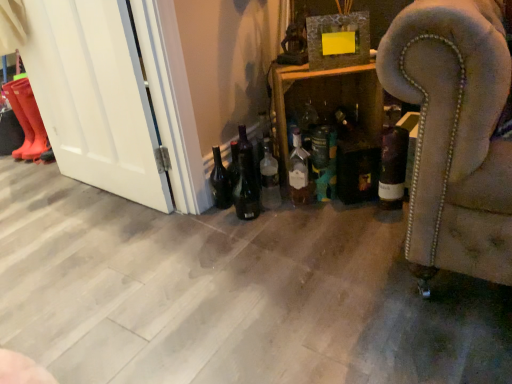
Locate an element on the screen. free space in front of translucent glass bottle at center, placed as the first bottle when sorted from left to right is located at coordinates (278, 228).